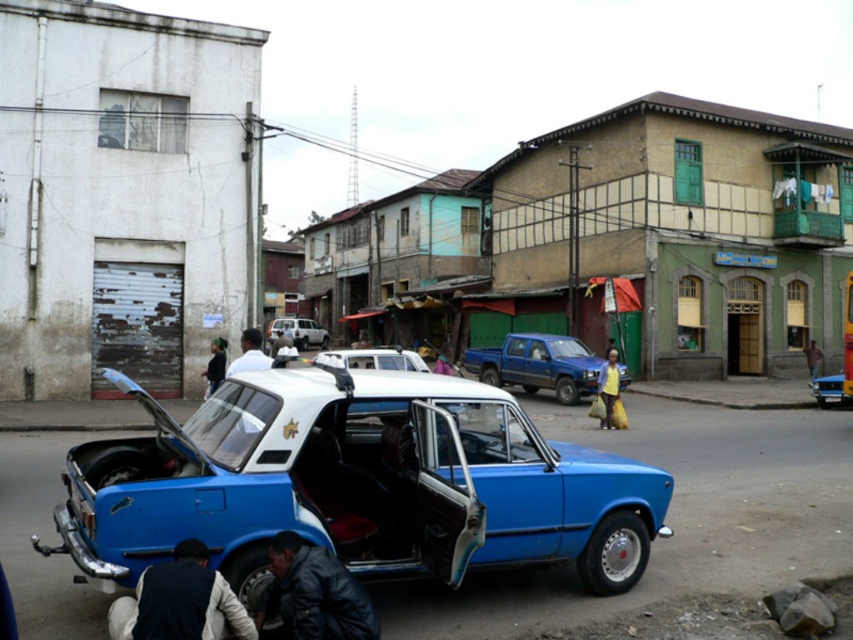
You are standing at the point labeled as point (355, 483) in the image. What object are you directly facing?

The point labeled as point (355, 483) corresponds to the blue matte car at center, so you are directly facing the blue matte car at center.

Consider the image. You are standing in the street scene and want to determine which of the two points, point [407,502] or point [613,396], is nearer to you. Based on the image, which point is closer?

Point [407,502] is closer to the camera than point [613,396], so it is the nearer one.